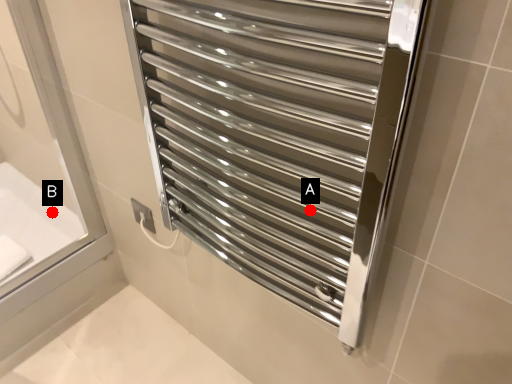
Question: Two points are circled on the image, labeled by A and B beside each circle. Among these points, which one is farthest from the camera?

Choices:
 (A) A is further
 (B) B is further

Answer: (B)